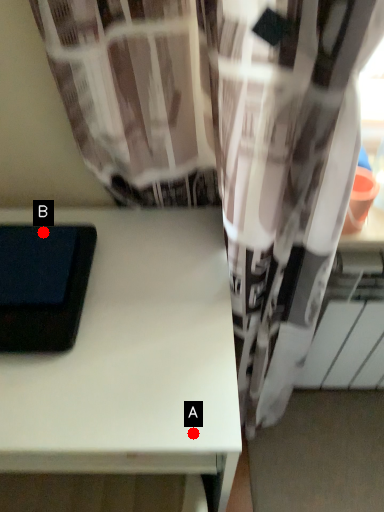
Question: Two points are circled on the image, labeled by A and B beside each circle. Which point is closer to the camera?

Choices:
 (A) A is closer
 (B) B is closer

Answer: (A)